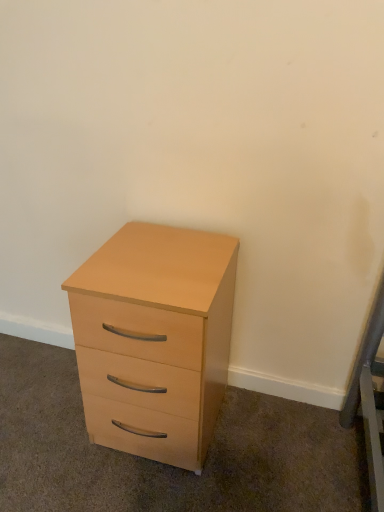
I want to click on free region on the left part of light wood/veneer chest of drawers at lower left, so click(x=44, y=418).